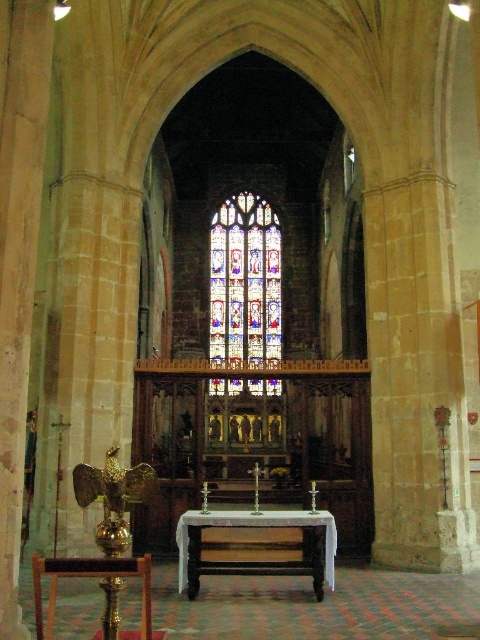
You are a tour guide leading a group in the church. You want to point out the stained glass window at center and the white polished wood altar at center. How far apart are these two landmarks?

The distance between the stained glass window at center and the white polished wood altar at center is 50.26 meters.

You are standing at the entrance of the church and want to light a candle at the altar. Which object should you approach first, the stained glass window at center or the white polished wood altar at center?

The white polished wood altar at center is to the right of the stained glass window at center. Since you are facing the altar from the entrance, you should approach the white polished wood altar at center first to light the candle.

You are an architect visiting the church and want to compare the height of the stained glass window at center and the white polished wood altar at center. Which one is taller?

The stained glass window at center has a greater height compared to the white polished wood altar at center, so the stained glass window at center is taller.